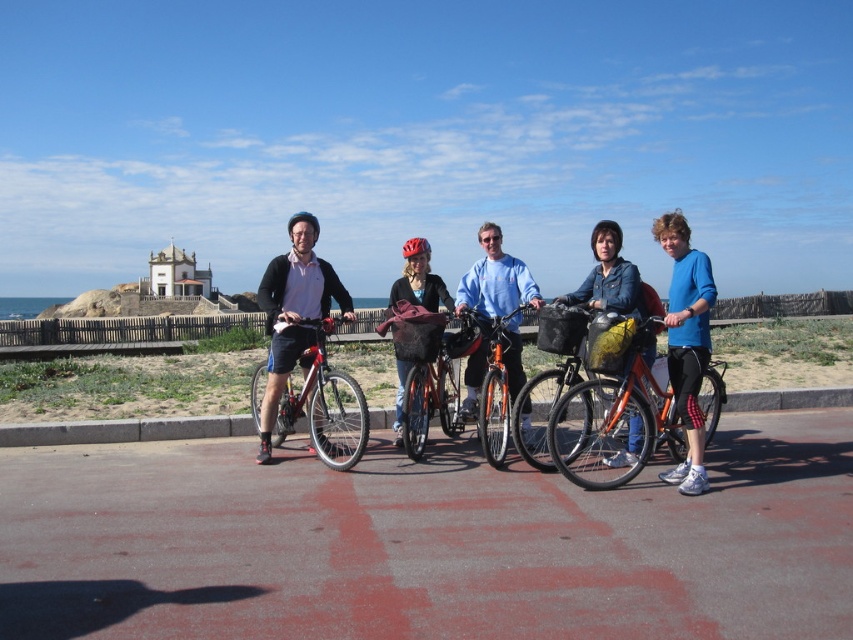
Question: Which of the following is the closest to the observer?

Choices:
 (A) (410, 257)
 (B) (625, 305)

Answer: (B)

Question: Is blue matte shirt at center positioned in front of shiny red bicycle at center?

Choices:
 (A) yes
 (B) no

Answer: (A)

Question: Does orange matte bicycle at center appear on the right side of denim jacket at center?

Choices:
 (A) yes
 (B) no

Answer: (B)

Question: Estimate the real-world distances between objects in this image. Which object is farther from the shiny metallic bicycle at left?

Choices:
 (A) blue matte shirt at center
 (B) shiny red bicycle at center

Answer: (A)

Question: Is orange matte bicycle at center wider than shiny metallic bicycle at left?

Choices:
 (A) yes
 (B) no

Answer: (A)

Question: Which object is the closest to the blue matte shirt at center?

Choices:
 (A) orange matte bicycle at center
 (B) denim jacket at center
 (C) orange metallic bicycle at center

Answer: (A)